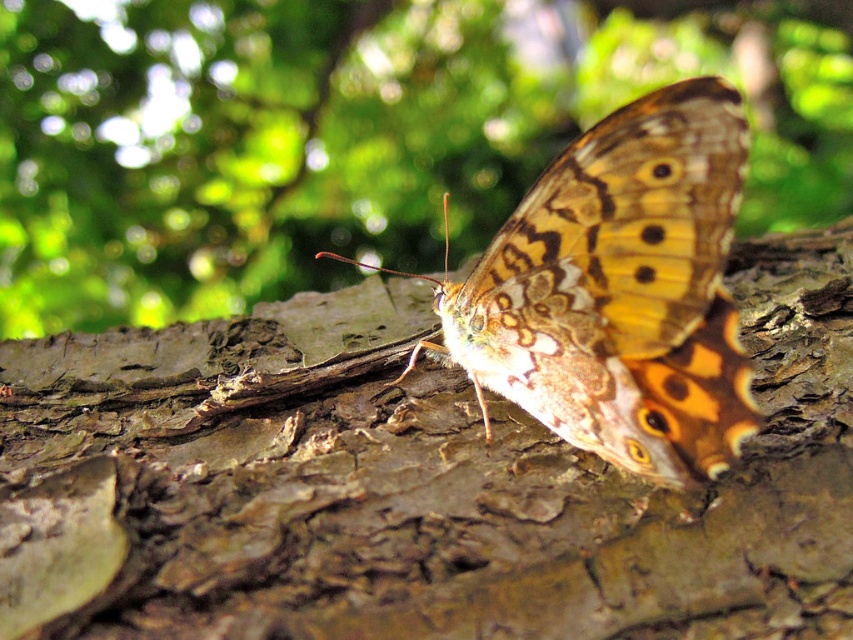
Which of these two, brown rough bark at center or brown textured butterfly at center, stands shorter?

brown textured butterfly at center

What do you see at coordinates (410, 483) in the screenshot? I see `brown rough bark at center` at bounding box center [410, 483].

Does point (366, 465) come farther from viewer compared to point (585, 429)?

That is True.

Find the location of a particular element. Image resolution: width=853 pixels, height=640 pixels. brown rough bark at center is located at coordinates (410, 483).